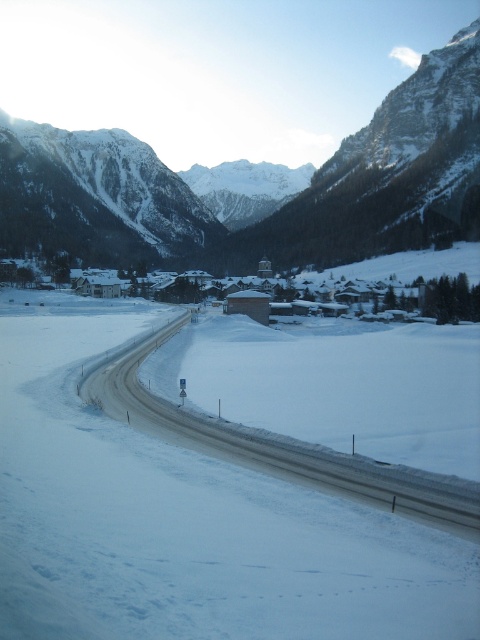
The width and height of the screenshot is (480, 640). Find the location of `snowy granite mountain range at upper center`. snowy granite mountain range at upper center is located at coordinates (259, 205).

I want to click on snowy granite mountain range at upper center, so click(x=259, y=205).